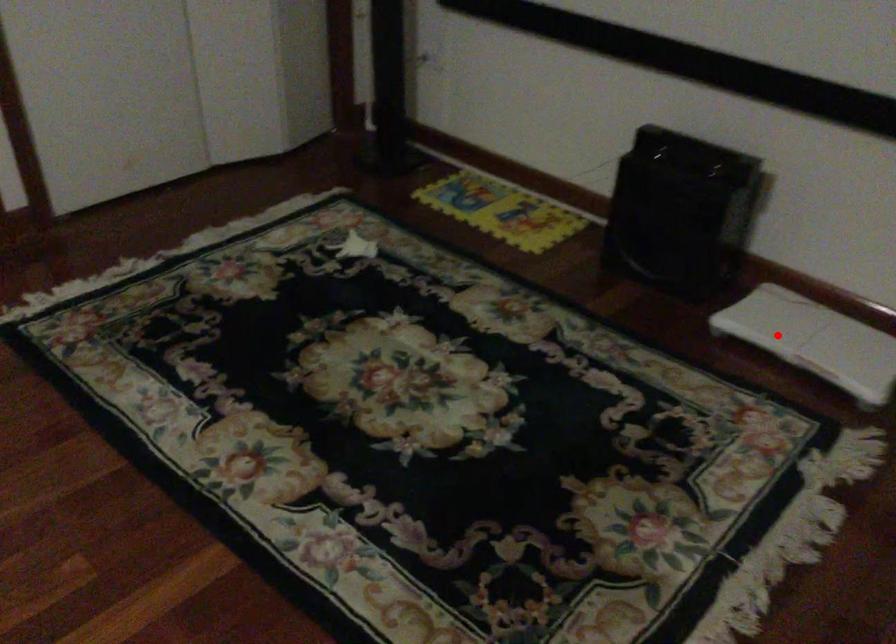
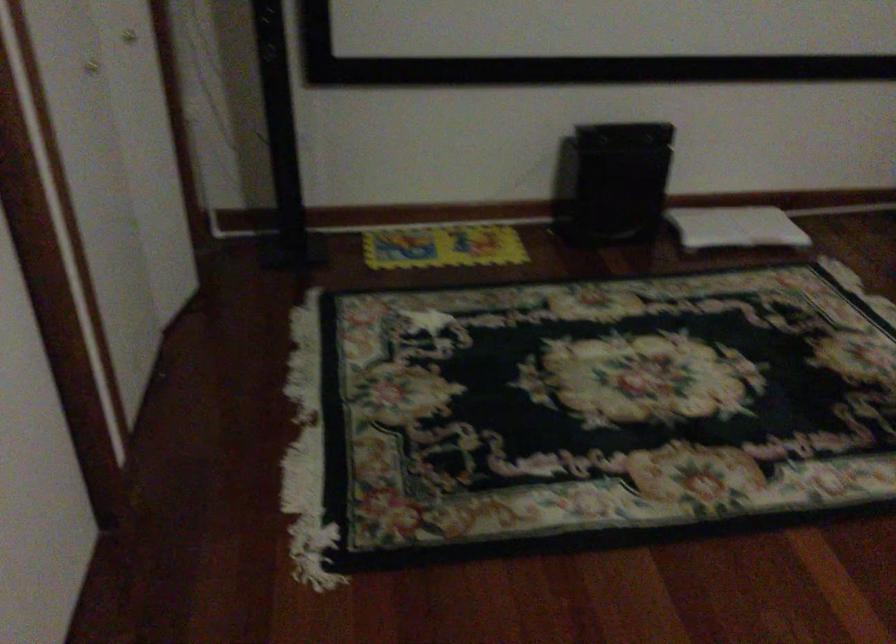
In the second image, find the point that corresponds to the highlighted location in the first image.

(735, 227)